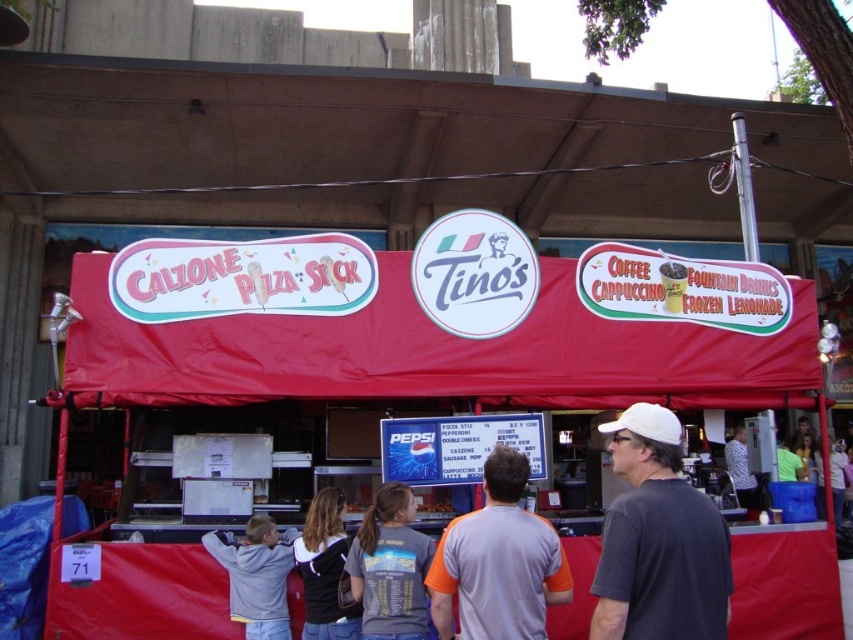
Question: Which object is positioned farthest from the dark gray t-shirt at center?

Choices:
 (A) black hoodie at center
 (B) yellow fabric shirt at center

Answer: (B)

Question: Does dark gray t-shirt at center lie behind white striped shirt at center?

Choices:
 (A) yes
 (B) no

Answer: (B)

Question: Considering the relative positions of black hoodie at center and yellow fabric shirt at center in the image provided, where is black hoodie at center located with respect to yellow fabric shirt at center?

Choices:
 (A) below
 (B) above

Answer: (B)

Question: Which point is closer to the camera?

Choices:
 (A) yellow fabric shirt at center
 (B) shiny plastic french fries at center

Answer: (B)

Question: From the image, what is the correct spatial relationship of red fabric canopy at center in relation to shiny plastic french fries at center?

Choices:
 (A) below
 (B) above

Answer: (B)

Question: Which of the following is the farthest from the observer?

Choices:
 (A) (804, 440)
 (B) (450, 512)
 (C) (323, 592)
 (D) (361, 545)

Answer: (A)